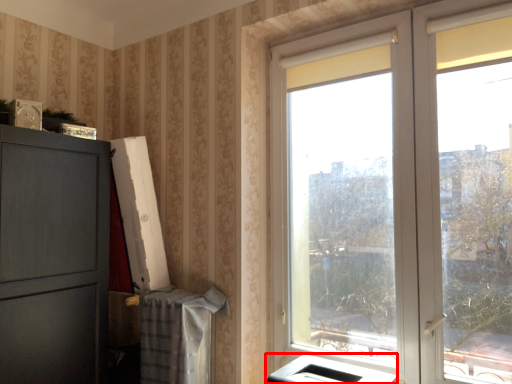
Question: From the image's perspective, considering the relative positions of appliance (annotated by the red box) and window in the image provided, where is appliance (annotated by the red box) located with respect to the staircase?

Choices:
 (A) below
 (B) above

Answer: (A)